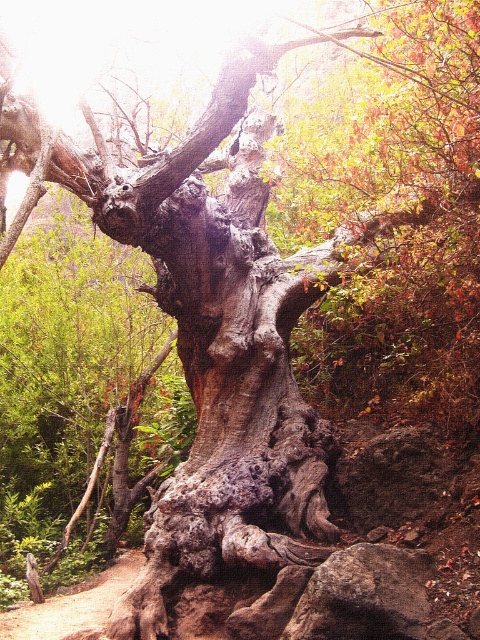
Find the location of a particular element. Image resolution: width=480 pixels, height=640 pixels. gray rough rock at lower right is located at coordinates (364, 595).

In the scene shown: Can you confirm if gray rough rock at lower right is wider than brown dirt trail at lower left?

In fact, gray rough rock at lower right might be narrower than brown dirt trail at lower left.

What do you see at coordinates (364, 595) in the screenshot? This screenshot has width=480, height=640. I see `gray rough rock at lower right` at bounding box center [364, 595].

Find the location of a particular element. Image resolution: width=480 pixels, height=640 pixels. gray rough rock at lower right is located at coordinates (364, 595).